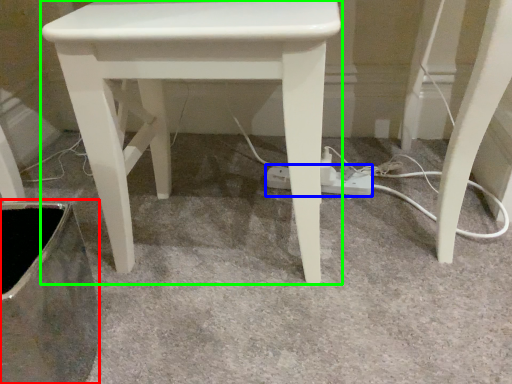
Question: Based on their relative distances, which object is farther from swivel chair (highlighted by a red box)? Choose from extension cord (highlighted by a blue box) and stool (highlighted by a green box).

Choices:
 (A) extension cord
 (B) stool

Answer: (A)